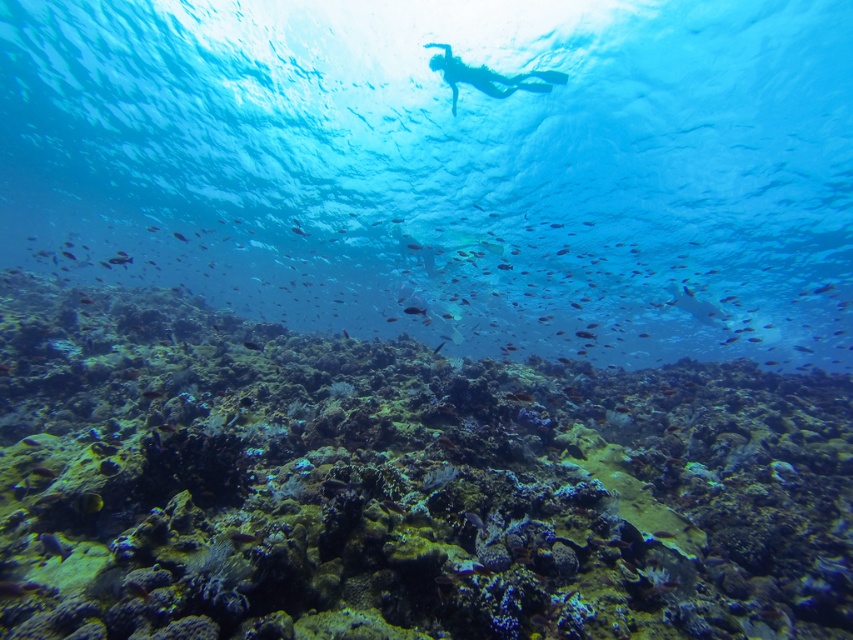
Question: Does rough textured coral reef at center have a larger size compared to transparent blue diver at upper center?

Choices:
 (A) no
 (B) yes

Answer: (B)

Question: Can you confirm if translucent blue water at center is positioned below shiny yellow fish at lower left?

Choices:
 (A) no
 (B) yes

Answer: (A)

Question: Which of these objects is positioned farthest from the transparent blue diver at upper center?

Choices:
 (A) shiny blue fish at center
 (B) shiny yellow fish at lower left
 (C) translucent blue water at center
 (D) rough textured coral reef at center

Answer: (C)

Question: Can you confirm if shiny yellow fish at lower left is positioned to the left of shiny blue fish at center?

Choices:
 (A) no
 (B) yes

Answer: (B)

Question: Which of the following is the farthest from the observer?

Choices:
 (A) (259, 83)
 (B) (26, 576)
 (C) (480, 88)
 (D) (97, 497)

Answer: (A)

Question: Among these points, which one is farthest from the camera?

Choices:
 (A) (474, 518)
 (B) (444, 61)
 (C) (100, 508)
 (D) (346, 531)

Answer: (B)